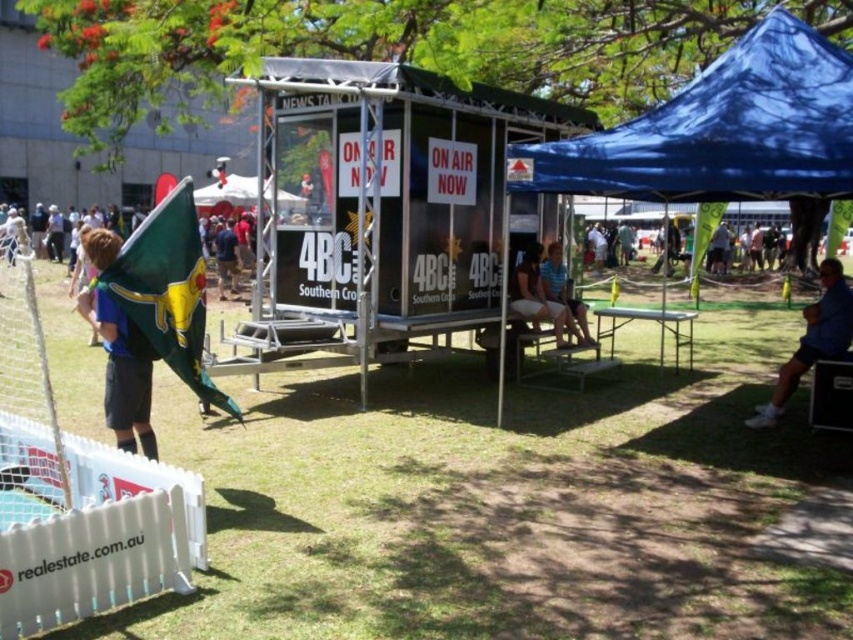
Is point (776, 100) closer to viewer compared to point (117, 305)?

No, (776, 100) is behind (117, 305).

Does point (761, 61) come behind point (137, 413)?

Yes.

The width and height of the screenshot is (853, 640). What are the coordinates of `blue fabric canopy at upper right` in the screenshot? It's located at (720, 131).

Does point (793, 384) lie in front of point (579, 333)?

Yes.

Between blue fabric bag at lower right and light brown wooden bench at center, which one is positioned higher?

Positioned higher is light brown wooden bench at center.

Is point (811, 326) closer to camera compared to point (515, 310)?

Yes, it is.

Find the location of a particular element. This screenshot has width=853, height=640. blue fabric bag at lower right is located at coordinates (813, 339).

Which is more to the right, blue fabric canopy at upper right or light brown wooden bench at center?

blue fabric canopy at upper right

Is blue fabric canopy at upper right bigger than light brown wooden bench at center?

Indeed, blue fabric canopy at upper right has a larger size compared to light brown wooden bench at center.

The image size is (853, 640). In order to click on blue fabric canopy at upper right in this screenshot , I will do pyautogui.click(x=720, y=131).